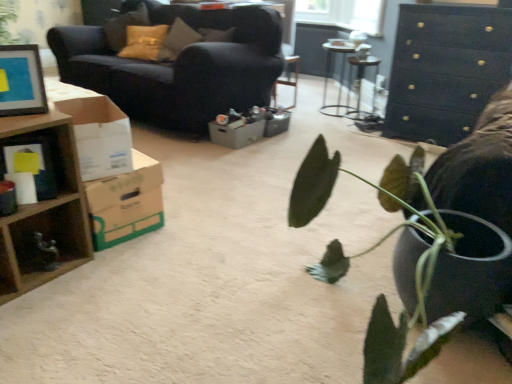
Question: Looking at the image, does metallic silver table at center, the 2th table positioned from the left, seem bigger or smaller compared to gray cardboard box at center, the first cardboard box when ordered from back to front?

Choices:
 (A) small
 (B) big

Answer: (B)

Question: Is point (348, 92) closer or farther from the camera than point (210, 135)?

Choices:
 (A) farther
 (B) closer

Answer: (A)

Question: Estimate the real-world distances between objects in this image. Which object is closer to the dark blue fabric couch at upper left?

Choices:
 (A) metallic silver table at center, which is counted as the 1th table, starting from the left
 (B) brown cardboard box at left, the second cardboard box in the front-to-back sequence
 (C) white cardboard box at left, positioned as the first cardboard box in front-to-back order
 (D) wooden cube at left
 (E) black wood chest of drawers at upper right

Answer: (E)

Question: Which of these objects is positioned farthest from the wooden cube at left?

Choices:
 (A) brown cardboard box at left, the second cardboard box in the front-to-back sequence
 (B) white cardboard box at left, the third cardboard box when ordered from back to front
 (C) metallic silver table at center, the second table from the right
 (D) dark blue fabric couch at upper left
 (E) metallic silver table at center, which ranks as the 1th table in right-to-left order

Answer: (C)